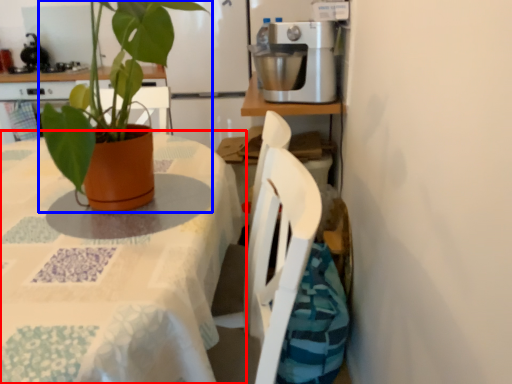
Question: Which point is closer to the camera, table (highlighted by a red box) or houseplant (highlighted by a blue box)?

Choices:
 (A) table
 (B) houseplant

Answer: (A)